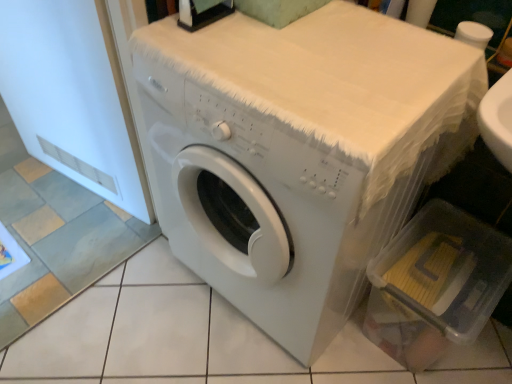
Where is `empty space that is ontop of clear plastic container at lower right`? empty space that is ontop of clear plastic container at lower right is located at coordinates (436, 261).